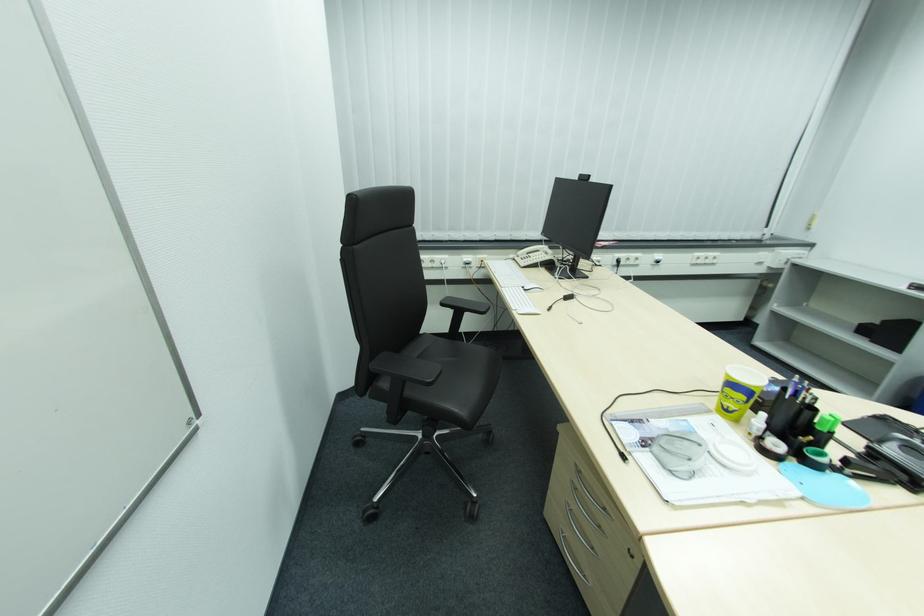
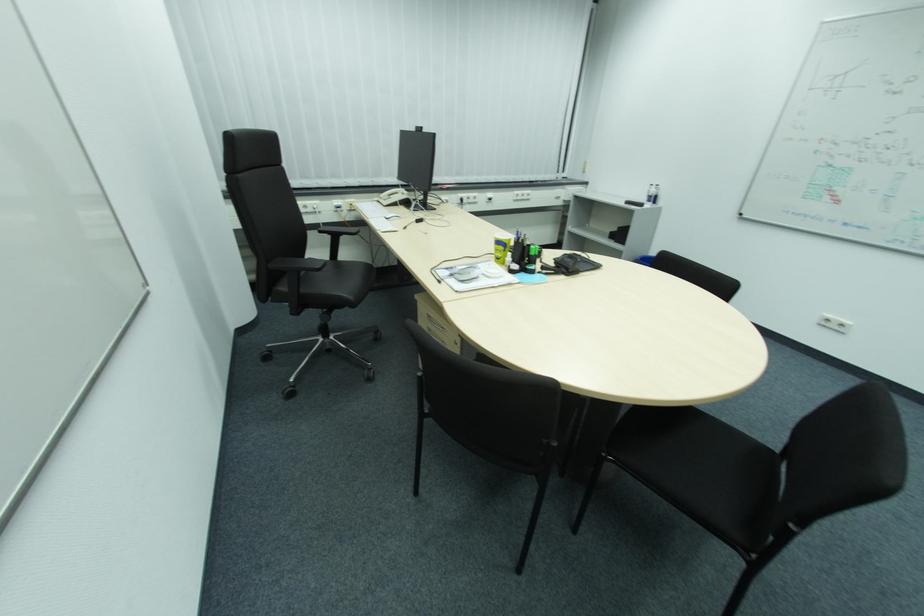
The point at (581, 464) is marked in the first image. Where is the corresponding point in the second image?

(433, 315)